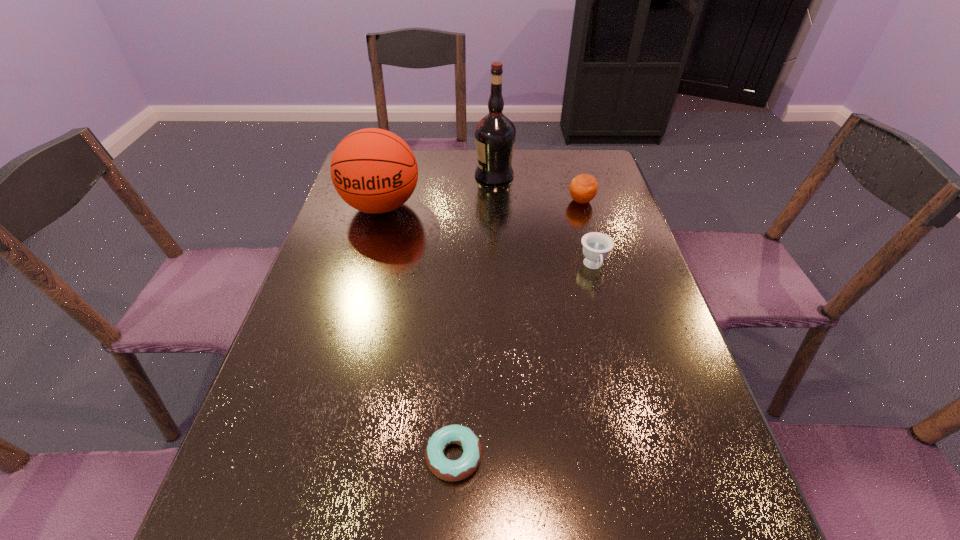
Find the location of a particular element. The width and height of the screenshot is (960, 540). object that is at the far left corner is located at coordinates (373, 170).

The image size is (960, 540). I want to click on vacant space at the far edge of the desktop, so click(535, 163).

You are a GUI agent. You are given a task and a screenshot of the screen. Output one action in this format:
    pyautogui.click(x=<x>, y=<y>)
    Task: Click on the vacant space at the left edge of the desktop
    
    Given the screenshot: What is the action you would take?
    pyautogui.click(x=300, y=386)

This screenshot has width=960, height=540. Find the location of `vacant space at the right edge of the desktop`. vacant space at the right edge of the desktop is located at coordinates (681, 358).

This screenshot has height=540, width=960. I want to click on vacant region at the far right corner of the desktop, so click(564, 181).

Identify the location of vacant point located between the shortest object and the teacup. The width and height of the screenshot is (960, 540). (524, 361).

I want to click on free spot between the teacup and the liquor, so click(x=544, y=221).

The height and width of the screenshot is (540, 960). What are the coordinates of `empty location between the orange and the basketball` in the screenshot? It's located at (481, 204).

At what (x,y) coordinates should I click in order to perform the action: click on unoccupied position between the basketball and the nearest object. Please return your answer as a coordinate pair (x, y). Looking at the image, I should click on (418, 332).

Locate an element on the screen. unoccupied area between the leftmost object and the shortest object is located at coordinates (418, 332).